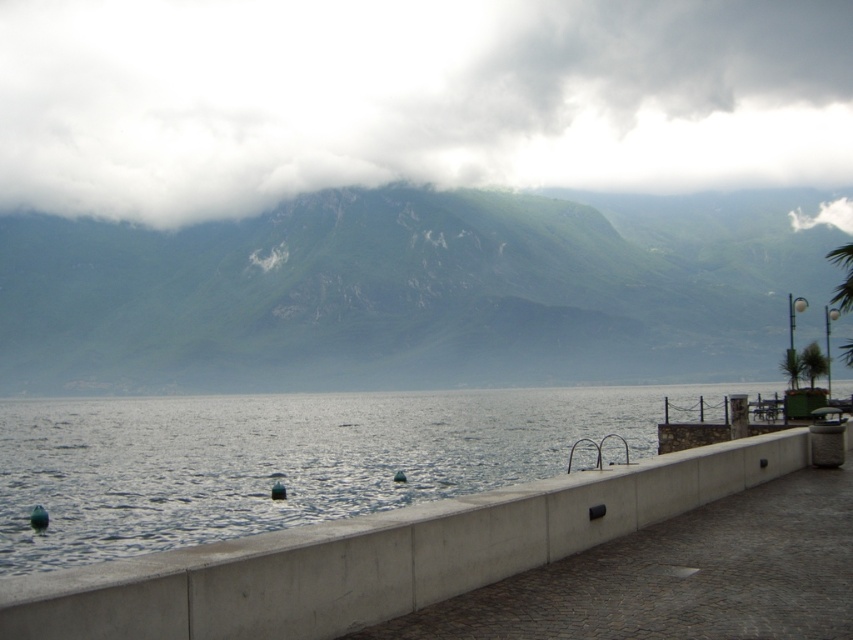
Question: In this image, where is white fluffy cloud at upper center located relative to concrete at center?

Choices:
 (A) right
 (B) left

Answer: (B)

Question: Does white fluffy cloud at upper center appear over green rocky mountain at upper center?

Choices:
 (A) yes
 (B) no

Answer: (A)

Question: Can you confirm if concrete at center is positioned above green leafy palm tree at right?

Choices:
 (A) no
 (B) yes

Answer: (A)

Question: Which object is the farthest from the green rocky mountain at upper center?

Choices:
 (A) green leafy palm tree at right
 (B) white fluffy cloud at upper center
 (C) concrete at center

Answer: (C)

Question: Which object appears closest to the camera in this image?

Choices:
 (A) concrete at center
 (B) white fluffy cloud at upper center

Answer: (A)

Question: Which point is closer to the camera?

Choices:
 (A) (815, 364)
 (B) (33, 348)
 (C) (339, 20)
 (D) (786, 470)

Answer: (D)